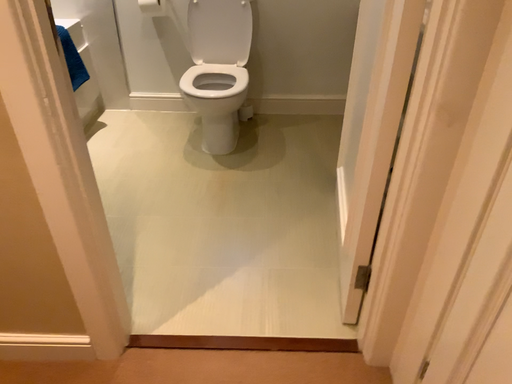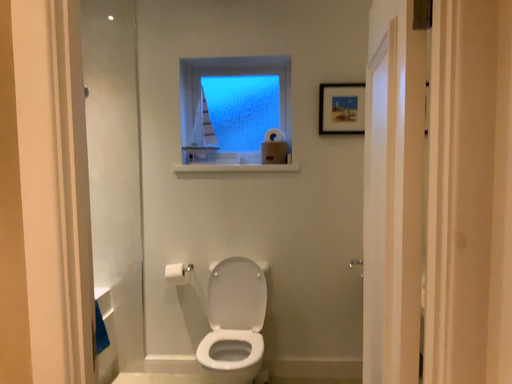
Question: How did the camera likely rotate when shooting the video?

Choices:
 (A) rotated downward
 (B) rotated upward

Answer: (B)